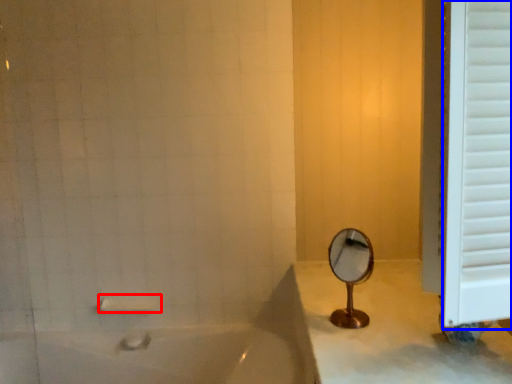
Question: Among these objects, which one is nearest to the camera, towel bar (highlighted by a red box) or window frame (highlighted by a blue box)?

Choices:
 (A) towel bar
 (B) window frame

Answer: (B)